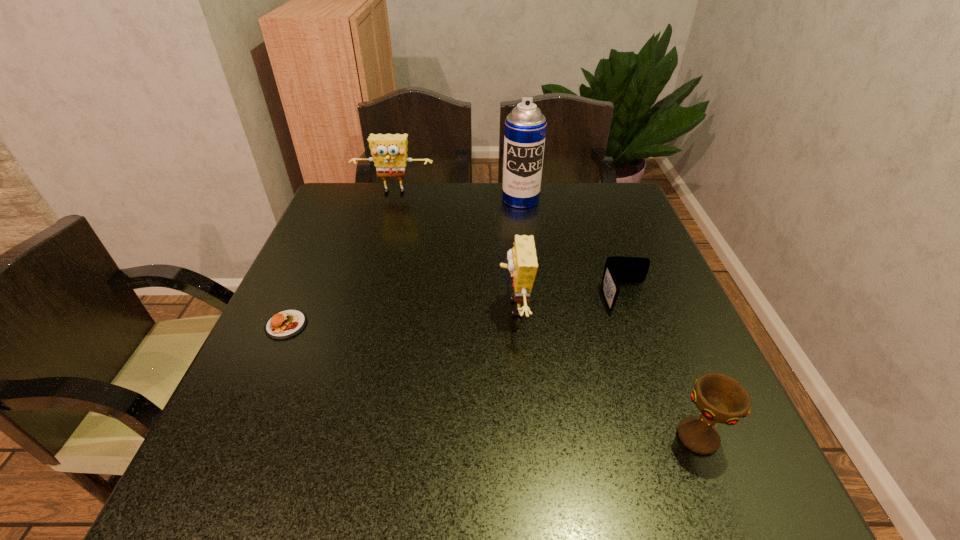
The height and width of the screenshot is (540, 960). In the image, there is a desktop. In order to click on blank space at the near right corner in this screenshot , I will do `click(673, 465)`.

At what (x,y) coordinates should I click in order to perform the action: click on empty location between the fourth tallest object and the patty (food). Please return your answer as a coordinate pair (x, y). This screenshot has height=540, width=960. Looking at the image, I should click on (492, 381).

Identify the location of vacant space in between the nearer sponge and the left sponge. (454, 251).

Image resolution: width=960 pixels, height=540 pixels. I want to click on vacant space in between the nearest object and the tallest object, so click(609, 318).

This screenshot has width=960, height=540. What are the coordinates of `unoccupied area between the right sponge and the patty (food)` in the screenshot? It's located at (400, 316).

This screenshot has height=540, width=960. Identify the location of free space between the nearer sponge and the shortest object. (400, 316).

Image resolution: width=960 pixels, height=540 pixels. Identify the location of free space between the wallet and the nearer sponge. (570, 302).

Locate an element on the screen. Image resolution: width=960 pixels, height=540 pixels. blank region between the left sponge and the nearer sponge is located at coordinates pos(454,251).

Where is `empty space between the wallet and the aerosol can`? The image size is (960, 540). empty space between the wallet and the aerosol can is located at coordinates (573, 248).

Identify which object is the second closest to the tallest object. Please provide its 2D coordinates. Your answer should be formatted as a tuple, i.e. [(x, y)], where the tuple contains the x and y coordinates of a point satisfying the conditions above.

[(522, 261)]